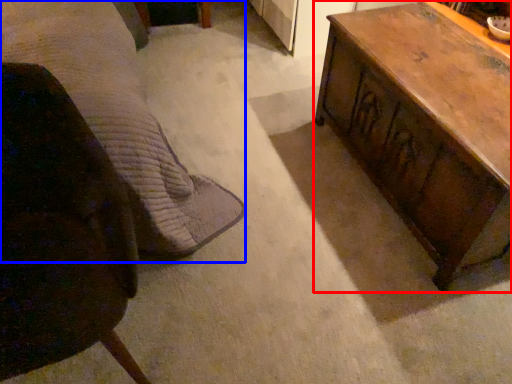
Question: Which object appears closest to the camera in this image, table (highlighted by a red box) or bed (highlighted by a blue box)?

Choices:
 (A) table
 (B) bed

Answer: (B)